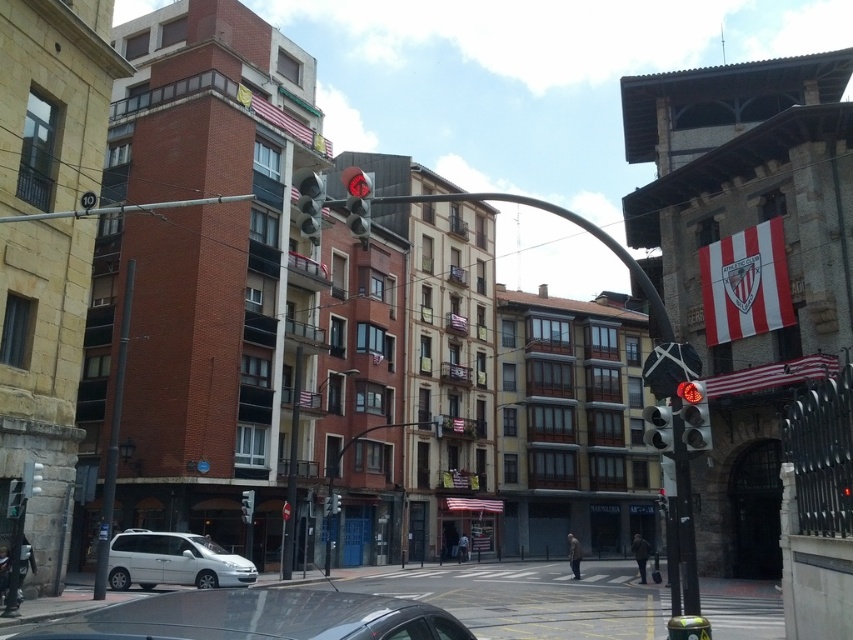
You are standing at the intersection and want to reach a specific point marked at coordinates point [146,557]. Given that your walking speed is 1.5 meters per second, how many seconds will it take you to reach that point?

The distance of point [146,557] from viewer is 44.30 meters. At a walking speed of 1.5 meters per second, it will take approximately 29.53 seconds to reach the point.

Looking at this image, you are a city planner reviewing this street layout. The smooth metal pole at left and the matte glass traffic light at center are both in your field of view. Which object is taller?

The smooth metal pole at left is much taller than the matte glass traffic light at center according to the description.